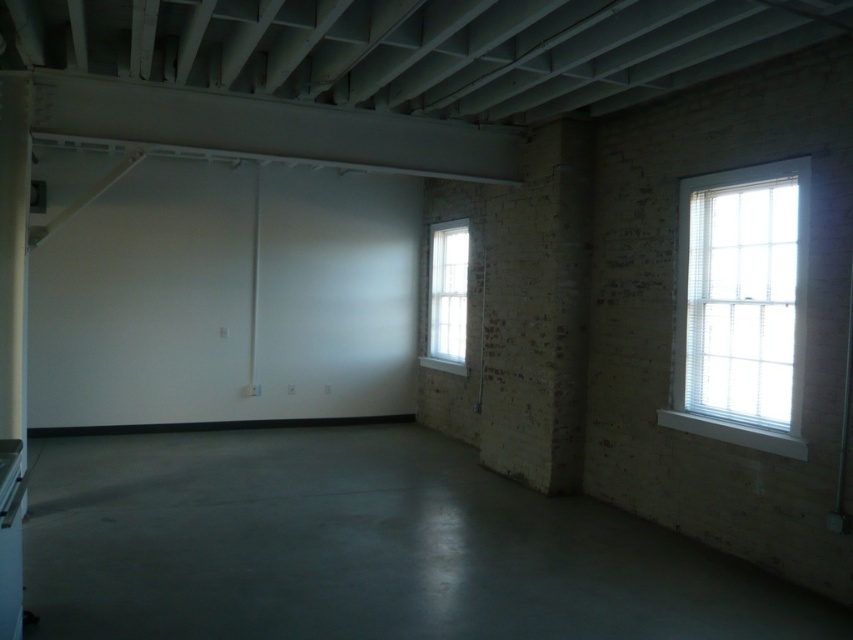
Question: Among these points, which one is nearest to the camera?

Choices:
 (A) (463, 365)
 (B) (799, 365)

Answer: (B)

Question: Which point is closer to the camera?

Choices:
 (A) (456, 241)
 (B) (751, 316)

Answer: (B)

Question: Does white wooden window at upper right have a greater width compared to white glass window at center?

Choices:
 (A) no
 (B) yes

Answer: (A)

Question: Does white wooden window at upper right appear on the left side of white glass window at center?

Choices:
 (A) yes
 (B) no

Answer: (B)

Question: Can you confirm if white wooden window at upper right is smaller than white glass window at center?

Choices:
 (A) no
 (B) yes

Answer: (B)